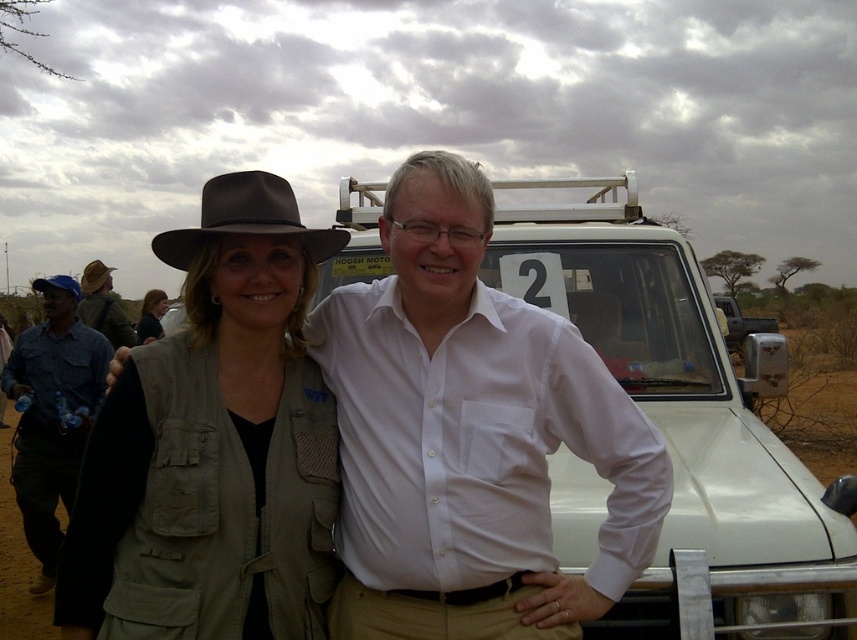
Question: Is white cotton shirt at center closer to camera compared to khaki fabric jacket at center?

Choices:
 (A) yes
 (B) no

Answer: (A)

Question: Is suede hat at upper left smaller than brown leather hat at upper left?

Choices:
 (A) yes
 (B) no

Answer: (A)

Question: Based on their relative distances, which object is nearer to the khaki fabric jacket at center?

Choices:
 (A) blue fabric hat at left
 (B) brown felt fedora at left
 (C) brown leather hat at upper left

Answer: (C)

Question: Which of the following is the closest to the observer?

Choices:
 (A) white cotton shirt at center
 (B) brown felt fedora at center
 (C) khaki fabric jacket at center
 (D) blue fabric hat at left

Answer: (A)

Question: Is brushed metal water bottle at left to the right of khaki fabric jacket at center from the viewer's perspective?

Choices:
 (A) yes
 (B) no

Answer: (A)

Question: Which of these objects is positioned closest to the khaki fabric jacket at center?

Choices:
 (A) brown felt fedora at center
 (B) suede hat at upper left

Answer: (B)